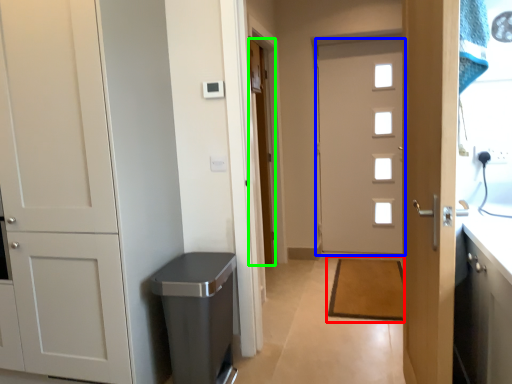
Question: Considering the real-world distances, which object is farthest from doormat (highlighted by a red box)? door (highlighted by a blue box) or door (highlighted by a green box)?

Choices:
 (A) door
 (B) door

Answer: (B)